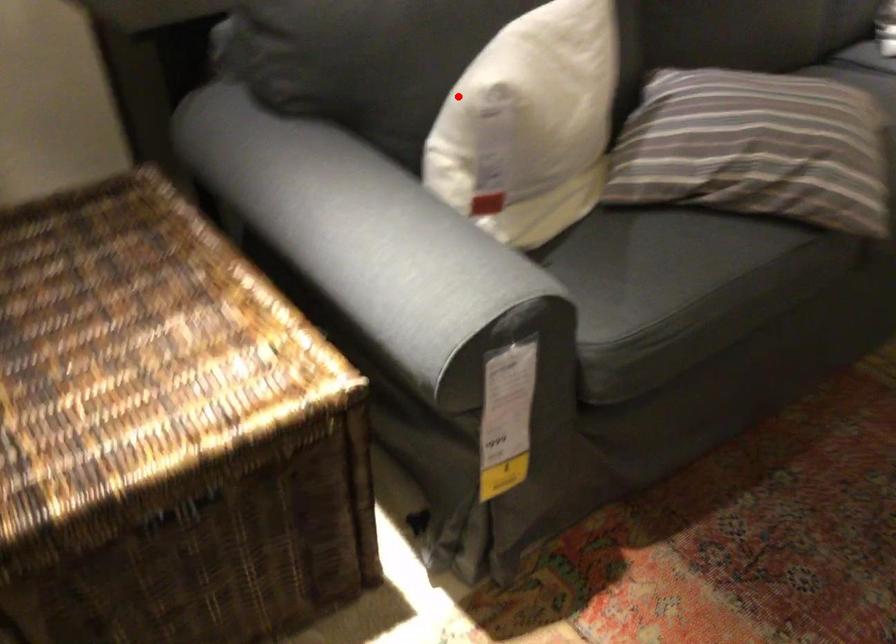
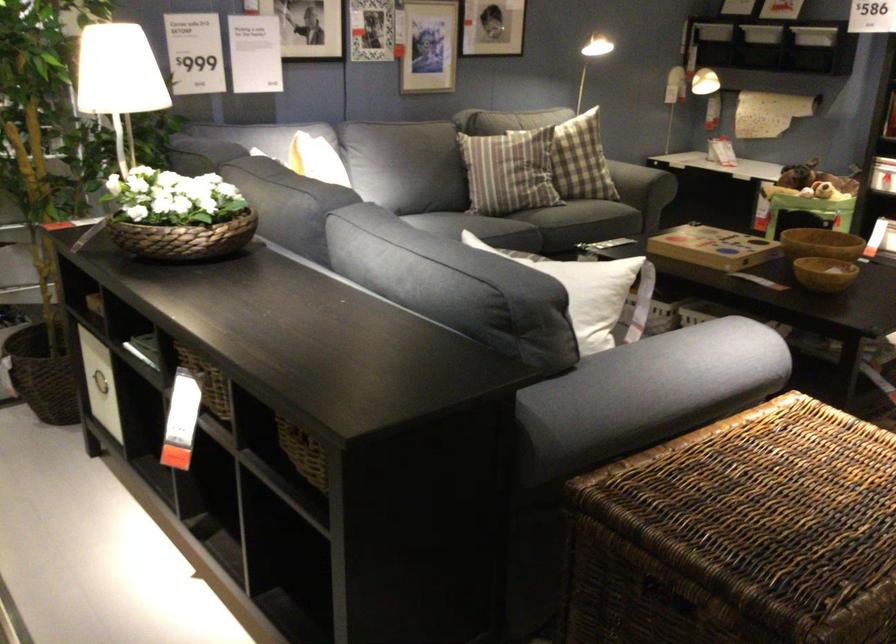
Where in the second image is the point corresponding to the highlighted location from the first image?

(581, 272)